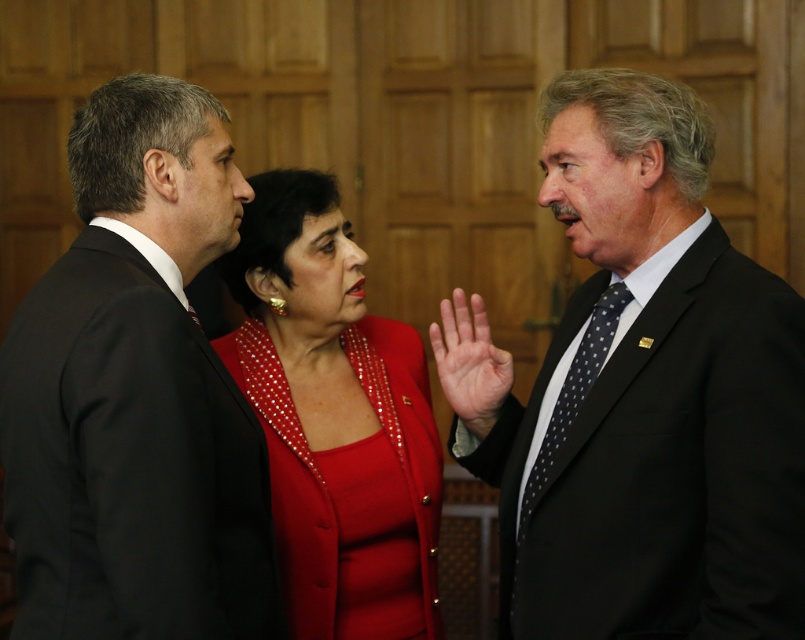
Question: In this image, where is black suit at left located relative to black dotted tie at right?

Choices:
 (A) left
 (B) right

Answer: (A)

Question: Which object appears closest to the camera in this image?

Choices:
 (A) black suit at left
 (B) black suit at right
 (C) shiny red blazer at center

Answer: (A)

Question: Can you confirm if black suit at left is wider than shiny red blazer at center?

Choices:
 (A) yes
 (B) no

Answer: (B)

Question: Which of the following is the closest to the observer?

Choices:
 (A) (539, 522)
 (B) (616, 292)

Answer: (A)

Question: Which object is the farthest from the black suit at left?

Choices:
 (A) smooth skin hand at center
 (B) shiny red blazer at center
 (C) black suit at right
 (D) black dotted tie at right

Answer: (D)

Question: Is black suit at left thinner than black dotted tie at right?

Choices:
 (A) yes
 (B) no

Answer: (B)